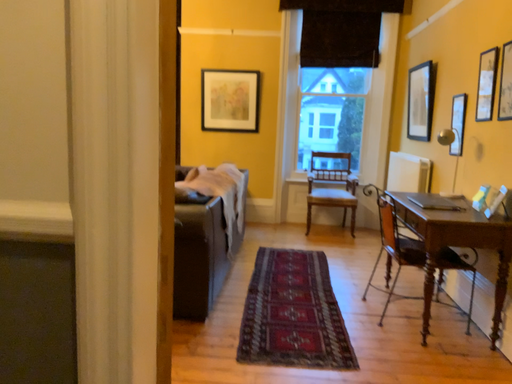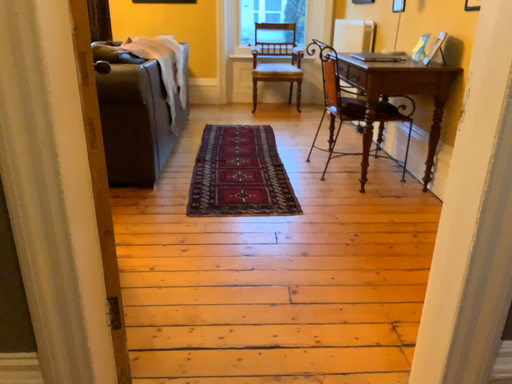
Question: Which way did the camera rotate in the video?

Choices:
 (A) rotated right
 (B) rotated left

Answer: (A)